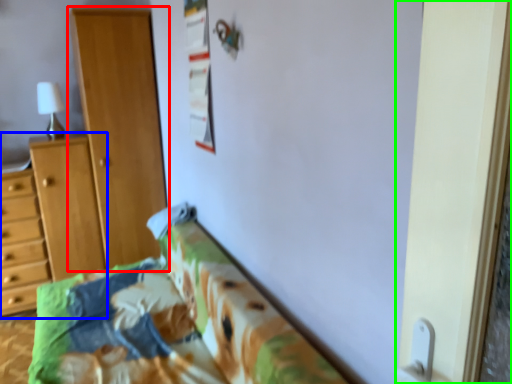
Question: Which is nearer to the cupboard (highlighted by a red box)? vanity (highlighted by a blue box) or screen door (highlighted by a green box).

Choices:
 (A) vanity
 (B) screen door

Answer: (A)